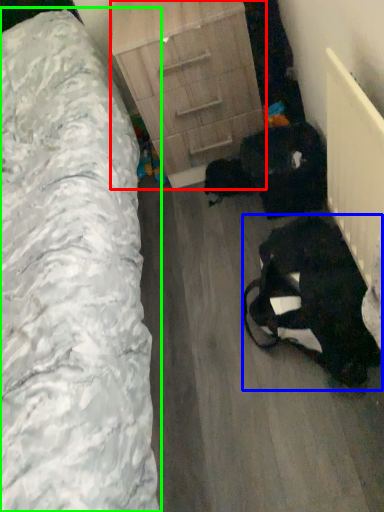
Question: Considering the real-world distances, which object is farthest from chest of drawers (highlighted by a red box)? animal (highlighted by a blue box) or furniture (highlighted by a green box)?

Choices:
 (A) animal
 (B) furniture

Answer: (A)